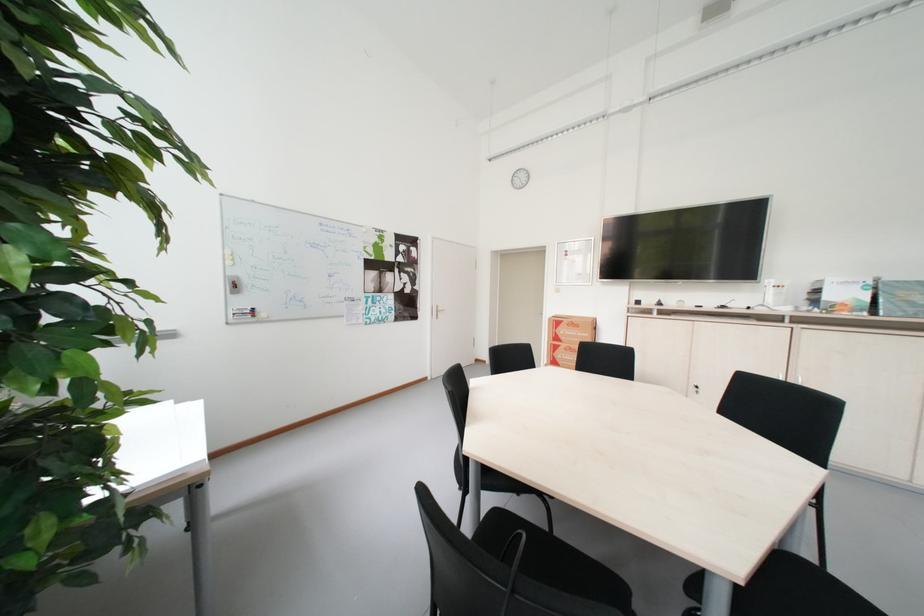
Locate an element on the screen. This screenshot has width=924, height=616. white telephone handset is located at coordinates (775, 294).